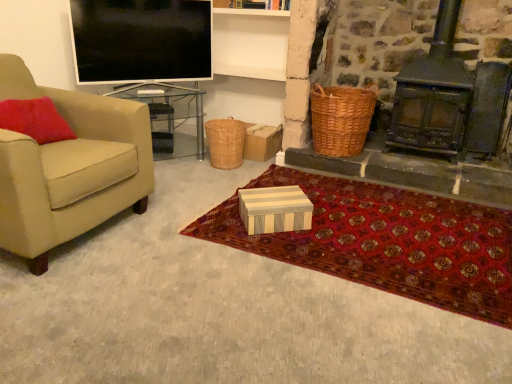
Question: Is white striped cardboard box at center, the first box in the left-to-right sequence, to the left or to the right of woven brown picnic basket at right, which ranks as the first picnic basket in right-to-left order, in the image?

Choices:
 (A) right
 (B) left

Answer: (B)

Question: From the image's perspective, is white striped cardboard box at center, the 2th box from the front, located above or below woven brown picnic basket at right, which ranks as the first picnic basket in right-to-left order?

Choices:
 (A) below
 (B) above

Answer: (A)

Question: Based on their relative distances, which object is nearer to the red carpet at center?

Choices:
 (A) woven brown picnic basket at right, the second picnic basket viewed from the left
 (B) black metal fireplace at right
 (C) beige fabric chair at left
 (D) transparent glass table at left
 (E) flat screen tv at upper left

Answer: (A)

Question: Which of these objects is positioned closest to the flat screen tv at upper left?

Choices:
 (A) white striped wood box at center, the 2th box in the top-to-bottom sequence
 (B) beige fabric chair at left
 (C) woven brown picnic basket at right, the second picnic basket viewed from the left
 (D) white striped cardboard box at center, the 1th box from the back
 (E) black metal fireplace at right

Answer: (D)